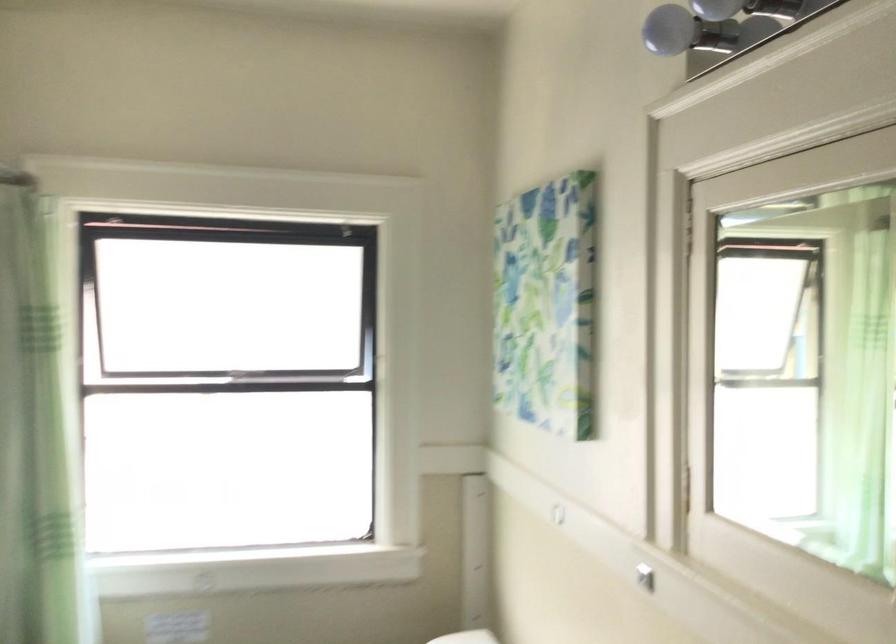
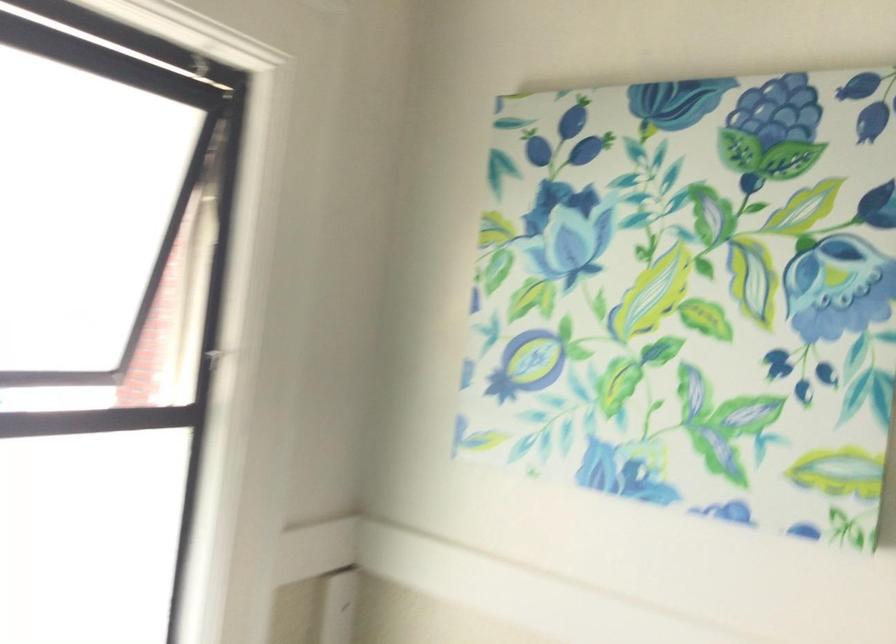
Locate, in the second image, the point that corresponds to (x=537, y=303) in the first image.

(693, 292)